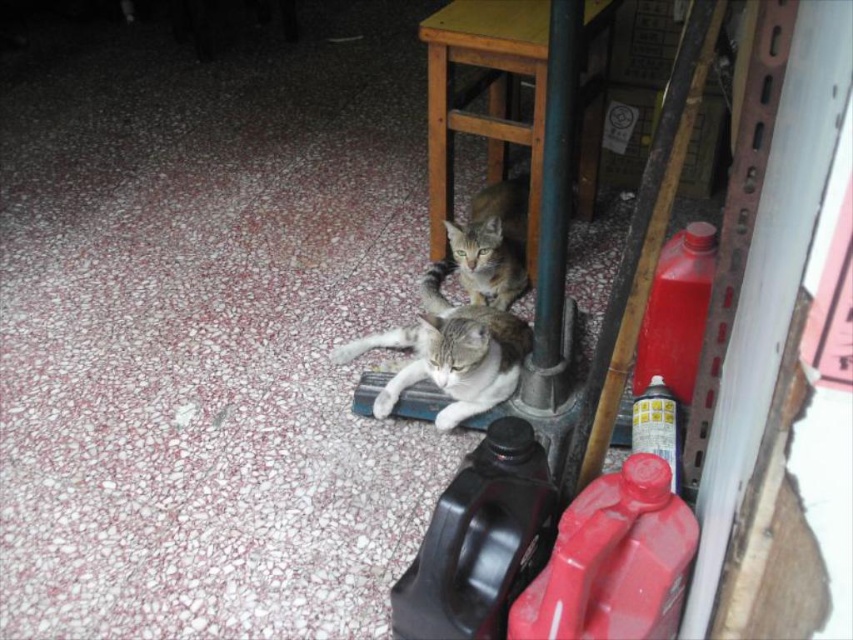
You are a photographer trying to capture both the gray tabby cat at center and the tabby fur cat at center in a single shot. Given their positions, can you fit both cats into the frame without moving either of them?

The gray tabby cat at center is much taller than the tabby fur cat at center, so you can still fit both into the frame as long as the camera is positioned to include the taller cat and the shorter one within the same view.

You are standing in the garage and want to place a heavy tool on the wooden table at upper center without disturbing the tabby fur cat at center. Is this possible?

The wooden table at upper center is located above the tabby fur cat at center, so placing the tool on the table would not disturb the cat since they are at different heights.

You are a cat owner who wants to place a new cat bed on the wooden table at upper center. However, you notice the gray tabby cat at center is already resting nearby. Based on their positions, can you place the bed on the table without disturbing the cat?

The wooden table at upper center is positioned on the right side of gray taby cat at center, so placing the bed on the table would not directly disturb the cat since it is on the right side away from where the cat is resting.